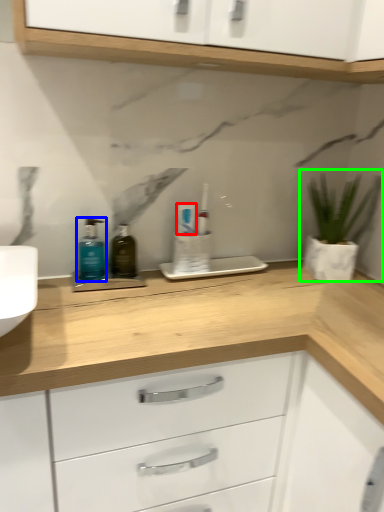
Question: Which object is the farthest from toothpaste (highlighted by a red box)? Choose among these: toiletry (highlighted by a blue box) or houseplant (highlighted by a green box).

Choices:
 (A) toiletry
 (B) houseplant

Answer: (B)